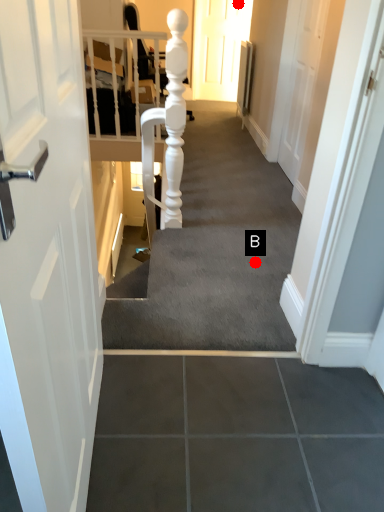
Question: Two points are circled on the image, labeled by A and B beside each circle. Which point appears farthest from the camera in this image?

Choices:
 (A) A is further
 (B) B is further

Answer: (A)